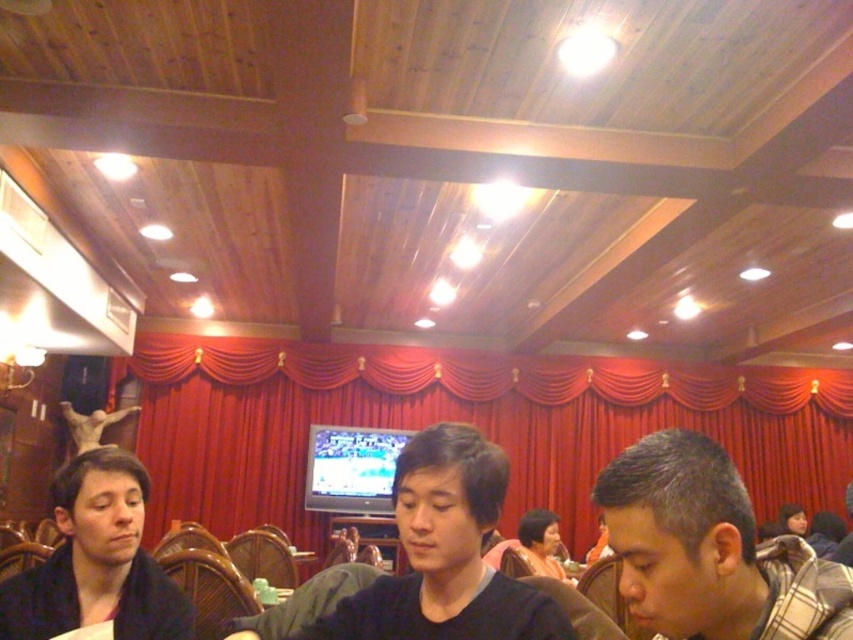
Who is taller, plaid fabric shirt at lower right or smooth black shirt at lower left?

smooth black shirt at lower left

Which is more to the right, plaid fabric shirt at lower right or smooth black shirt at lower left?

plaid fabric shirt at lower right

In order to click on plaid fabric shirt at lower right in this screenshot , I will do `click(711, 548)`.

Locate an element on the screen. The height and width of the screenshot is (640, 853). plaid fabric shirt at lower right is located at coordinates (711, 548).

Between point (587, 468) and point (654, 628), which one is positioned in front?

Positioned in front is point (654, 628).

Can you confirm if red velvet curtain at center is positioned to the left of plaid fabric shirt at lower right?

Correct, you'll find red velvet curtain at center to the left of plaid fabric shirt at lower right.

Who is more forward, (x=751, y=467) or (x=809, y=576)?

Positioned in front is point (x=809, y=576).

Locate an element on the screen. This screenshot has height=640, width=853. red velvet curtain at center is located at coordinates (462, 420).

Can you confirm if red velvet curtain at center is bigger than black matte shirt at center?

No.

Is point (350, 400) positioned after point (440, 504)?

That is True.

This screenshot has height=640, width=853. What are the coordinates of `red velvet curtain at center` in the screenshot? It's located at (462, 420).